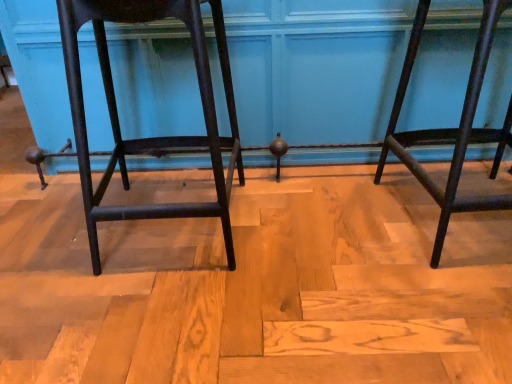
Question: From a real-world perspective, is matte black stool at left, which is the first furniture from left to right, physically located above or below matte black stool at right, the 1th furniture from the right?

Choices:
 (A) below
 (B) above

Answer: (B)

Question: Based on their positions, is matte black stool at left, which is the first furniture from left to right, located to the left or right of matte black stool at right, positioned as the second furniture in left-to-right order?

Choices:
 (A) right
 (B) left

Answer: (B)

Question: From the image's perspective, is matte black stool at left, positioned as the 2th furniture in right-to-left order, above or below matte black stool at right, the 1th furniture from the right?

Choices:
 (A) above
 (B) below

Answer: (B)

Question: From the image's perspective, is matte black stool at right, positioned as the second furniture in left-to-right order, positioned above or below matte black stool at left, which is the first furniture from left to right?

Choices:
 (A) below
 (B) above

Answer: (B)

Question: Is point (466, 99) closer or farther from the camera than point (56, 1)?

Choices:
 (A) closer
 (B) farther

Answer: (B)

Question: Looking at the image, does matte black stool at right, the 1th furniture from the right, seem bigger or smaller compared to matte black stool at left, positioned as the 2th furniture in right-to-left order?

Choices:
 (A) small
 (B) big

Answer: (B)

Question: Visually, is matte black stool at right, the 1th furniture from the right, positioned to the left or to the right of matte black stool at left, which is the first furniture from left to right?

Choices:
 (A) left
 (B) right

Answer: (B)